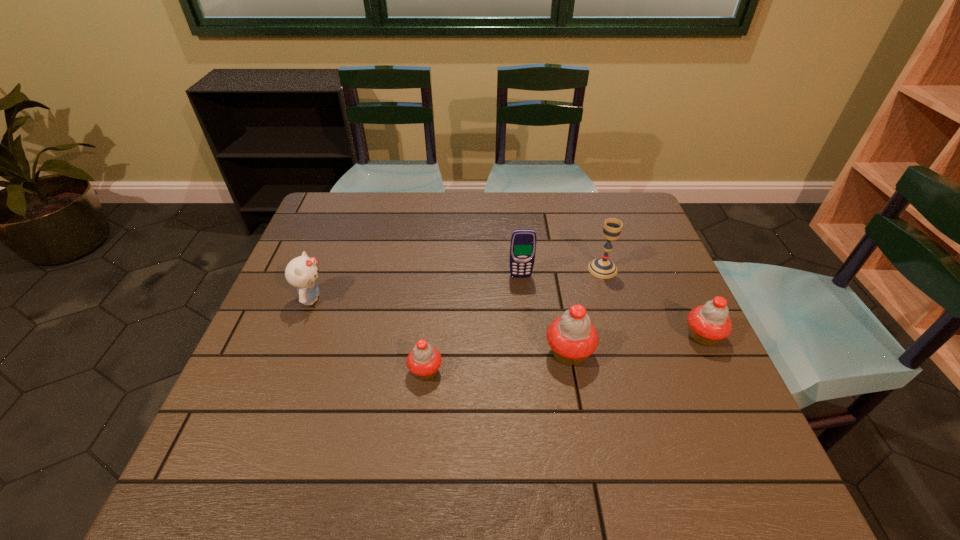
Identify the location of vacant point located between the fifth object from right to left and the third farthest object. The width and height of the screenshot is (960, 540). (369, 335).

Identify the location of vacant area that lies between the third object from right to left and the rightmost cupcake. (636, 345).

You are a GUI agent. You are given a task and a screenshot of the screen. Output one action in this format:
    pyautogui.click(x=<x>, y=<y>)
    Task: Click on the free space between the leftmost object and the second cupcake from right to left
    
    Given the screenshot: What is the action you would take?
    (x=441, y=326)

Locate an element on the screen. This screenshot has width=960, height=540. free spot between the third object from right to left and the shortest object is located at coordinates (497, 362).

Where is `free space between the chalice and the leftmost cupcake`? free space between the chalice and the leftmost cupcake is located at coordinates (514, 320).

Locate which object is the third closest to the fifth object from right to left. Please provide its 2D coordinates. Your answer should be formatted as a tuple, i.e. [(x, y)], where the tuple contains the x and y coordinates of a point satisfying the conditions above.

[(523, 241)]

Identify the location of the fourth closest object to the second cupcake from right to left. (424, 360).

Locate an element on the screen. Image resolution: width=960 pixels, height=540 pixels. cupcake that is the closest one to the rightmost object is located at coordinates (572, 337).

Locate an element on the screen. The image size is (960, 540). cupcake that is the nearest to the kitten is located at coordinates (424, 360).

At what (x,y) coordinates should I click in order to perform the action: click on vacant space that satisfies the following two spatial constraints: 1. on the front-facing side of the third farthest object; 2. on the right side of the tallest cupcake. Please return your answer as a coordinate pair (x, y). This screenshot has width=960, height=540. Looking at the image, I should click on (291, 353).